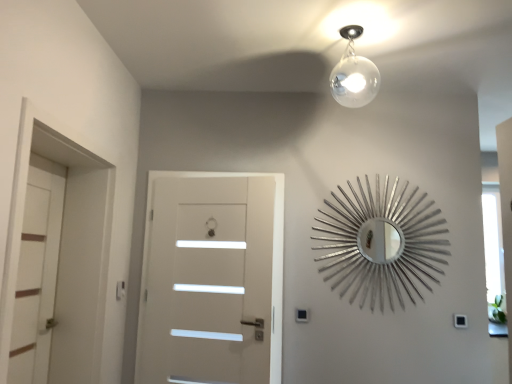
Question: Considering the positions of white matte door at left, marked as the 1th door in a left-to-right arrangement, and black plastic light switch at lower right in the image, is white matte door at left, marked as the 1th door in a left-to-right arrangement, wider or thinner than black plastic light switch at lower right?

Choices:
 (A) wide
 (B) thin

Answer: (A)

Question: Looking at the image, does white matte door at left, marked as the 2th door in a right-to-left arrangement, seem bigger or smaller compared to black plastic light switch at lower right?

Choices:
 (A) big
 (B) small

Answer: (A)

Question: Which of these objects is positioned farthest from the white matte door at center, the second door positioned from the left?

Choices:
 (A) silver metallic sunburst mirror at upper right
 (B) black plastic light switch at lower right
 (C) white matte door at left, marked as the 1th door in a left-to-right arrangement

Answer: (B)

Question: Estimate the real-world distances between objects in this image. Which object is farther from the white matte door at left, marked as the 1th door in a left-to-right arrangement?

Choices:
 (A) black plastic light switch at lower right
 (B) white matte door at center, which is the first door from right to left
 (C) silver metallic sunburst mirror at upper right

Answer: (A)